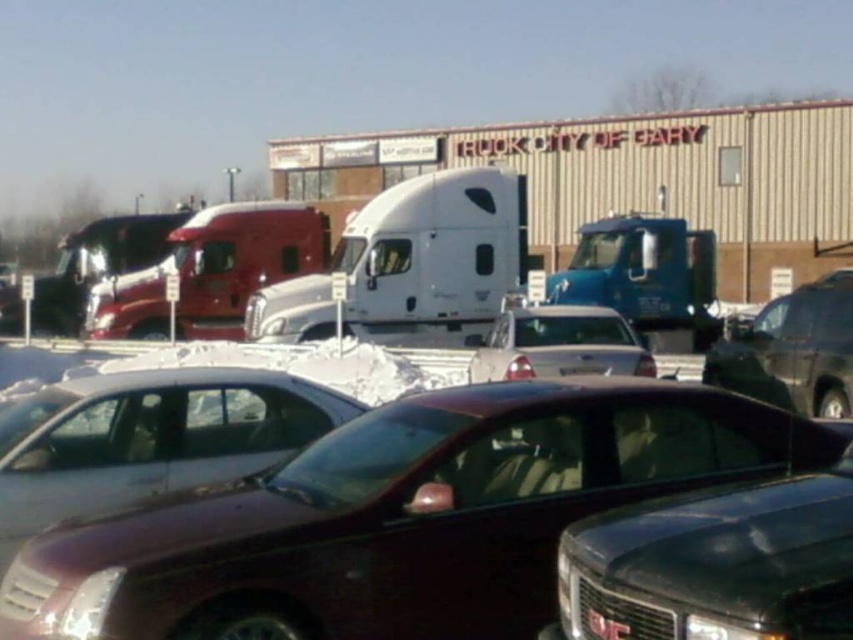
From the picture: Can you confirm if black glossy suv at center is thinner than shiny red semi-truck at center?

Correct, black glossy suv at center's width is less than shiny red semi-truck at center's.

Describe the element at coordinates (715, 564) in the screenshot. The image size is (853, 640). I see `black glossy suv at center` at that location.

Image resolution: width=853 pixels, height=640 pixels. What are the coordinates of `black glossy suv at center` in the screenshot? It's located at (715, 564).

At what (x,y) coordinates should I click in order to perform the action: click on black glossy suv at center. Please return your answer as a coordinate pair (x, y). The width and height of the screenshot is (853, 640). Looking at the image, I should click on (715, 564).

Does black glossy suv at center come in front of shiny black suv at right?

Yes, it is.

Which is behind, point (694, 634) or point (815, 296)?

Positioned behind is point (815, 296).

The image size is (853, 640). In order to click on black glossy suv at center in this screenshot , I will do `click(715, 564)`.

Between shiny maroon sedan at center and shiny red semi-truck at center, which one has more height?

With more height is shiny red semi-truck at center.

Find the location of a particular element. Image resolution: width=853 pixels, height=640 pixels. shiny maroon sedan at center is located at coordinates (403, 516).

Does point (62, 570) come behind point (157, 337)?

That is False.

Locate an element on the screen. This screenshot has width=853, height=640. shiny maroon sedan at center is located at coordinates (403, 516).